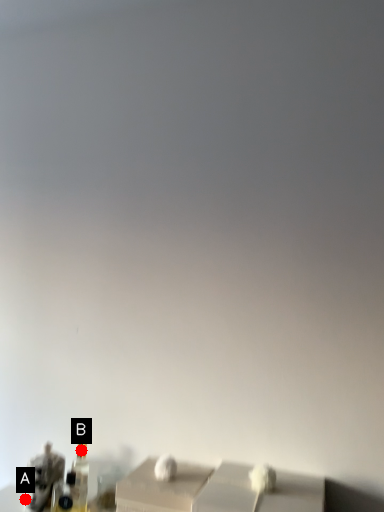
Question: Two points are circled on the image, labeled by A and B beside each circle. Which point is farther from the camera taking this photo?

Choices:
 (A) A is further
 (B) B is further

Answer: (B)